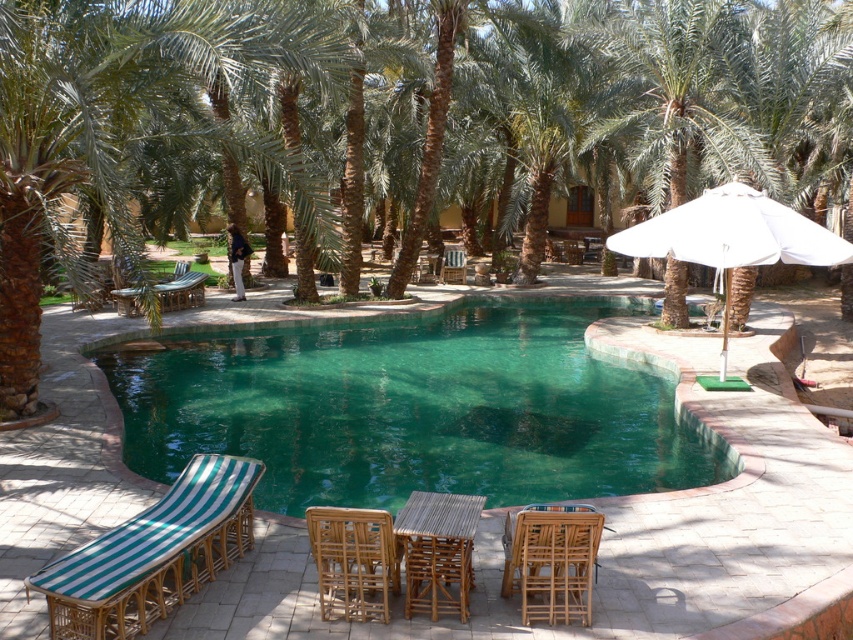
Does bamboo chair at lower center have a greater width compared to green striped wood table at lower left?

Incorrect, bamboo chair at lower center's width does not surpass green striped wood table at lower left's.

Measure the distance from bamboo chair at lower center to green striped wood table at lower left.

bamboo chair at lower center is 11.95 meters from green striped wood table at lower left.

You are a GUI agent. You are given a task and a screenshot of the screen. Output one action in this format:
    pyautogui.click(x=<x>, y=<y>)
    Task: Click on the bamboo chair at lower center
    Image resolution: width=853 pixels, height=640 pixels.
    Given the screenshot: What is the action you would take?
    pyautogui.click(x=550, y=561)

In order to click on bamboo chair at lower center in this screenshot , I will do `click(550, 561)`.

Between green striped rattan daybed at lower left and wooden chair at center, which one is positioned higher?

Positioned higher is wooden chair at center.

Does green striped rattan daybed at lower left lie behind wooden chair at center?

No.

In order to click on green striped rattan daybed at lower left in this screenshot , I will do `click(154, 554)`.

Measure the distance between bamboo chair at lower center and bamboo table at center.

A: bamboo chair at lower center and bamboo table at center are 17.62 inches apart from each other.

Between bamboo chair at lower center and bamboo table at center, which one appears on the right side from the viewer's perspective?

From the viewer's perspective, bamboo chair at lower center appears more on the right side.

Where is `bamboo chair at lower center`? This screenshot has height=640, width=853. bamboo chair at lower center is located at coordinates click(x=550, y=561).